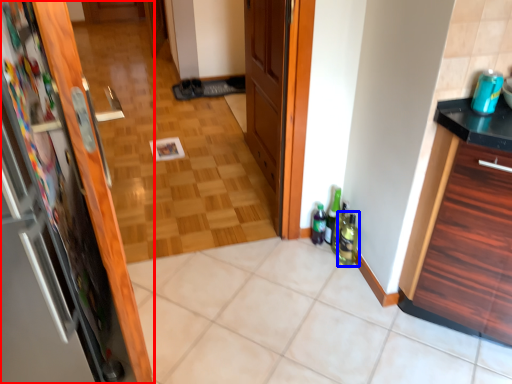
Question: Which object is further to the camera taking this photo, door (highlighted by a red box) or beverage (highlighted by a blue box)?

Choices:
 (A) door
 (B) beverage

Answer: (B)